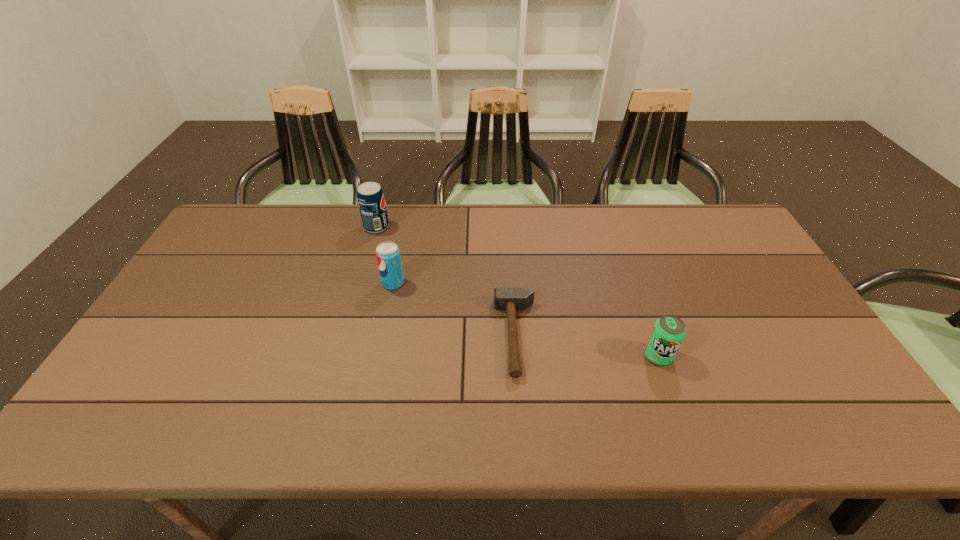
This screenshot has height=540, width=960. I want to click on vacant space situated 0.100m on the front-facing side of the rightmost object, so click(675, 404).

The width and height of the screenshot is (960, 540). Identify the location of vacant space located on the striking surface of the third object from left to right. (366, 336).

Find the location of a particular element. vacant space situated 0.350m on the striking surface of the third object from left to right is located at coordinates (362, 336).

Image resolution: width=960 pixels, height=540 pixels. Identify the location of free region located 0.150m on the striking surface of the third object from left to right. (438, 336).

Where is `object located at the far edge`? This screenshot has width=960, height=540. object located at the far edge is located at coordinates (370, 196).

Where is `free space at the far edge`? This screenshot has width=960, height=540. free space at the far edge is located at coordinates (602, 204).

Image resolution: width=960 pixels, height=540 pixels. In the image, there is a desktop. Find the location of `vacant space at the near edge`. vacant space at the near edge is located at coordinates (613, 422).

This screenshot has width=960, height=540. In the image, there is a desktop. Identify the location of vacant space at the right edge. (735, 292).

Find the location of a particular element. The height and width of the screenshot is (540, 960). vacant region at the near left corner of the desktop is located at coordinates (117, 408).

At what (x,y) coordinates should I click in order to perform the action: click on free space between the second farthest object and the third object from left to right. Please return your answer as a coordinate pair (x, y). Looking at the image, I should click on (455, 309).